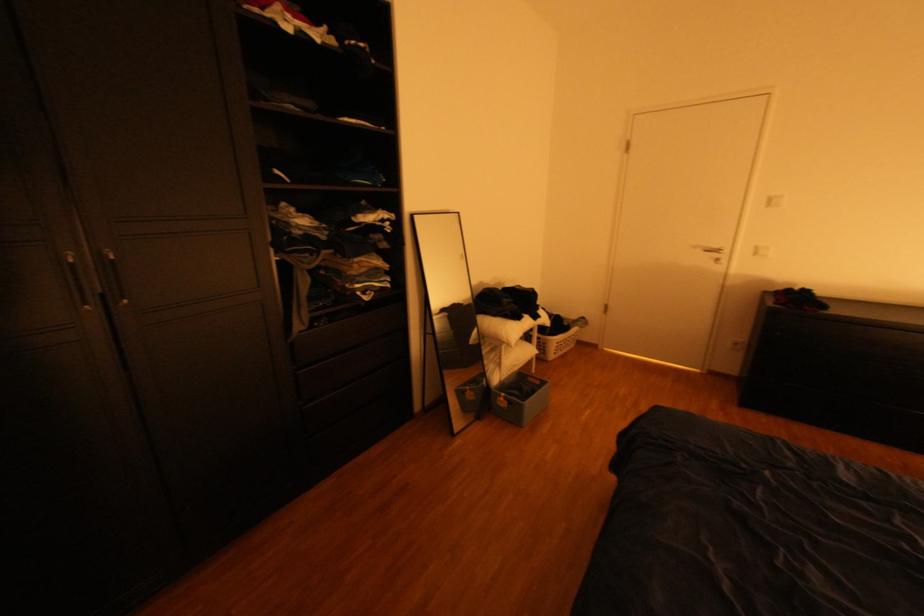
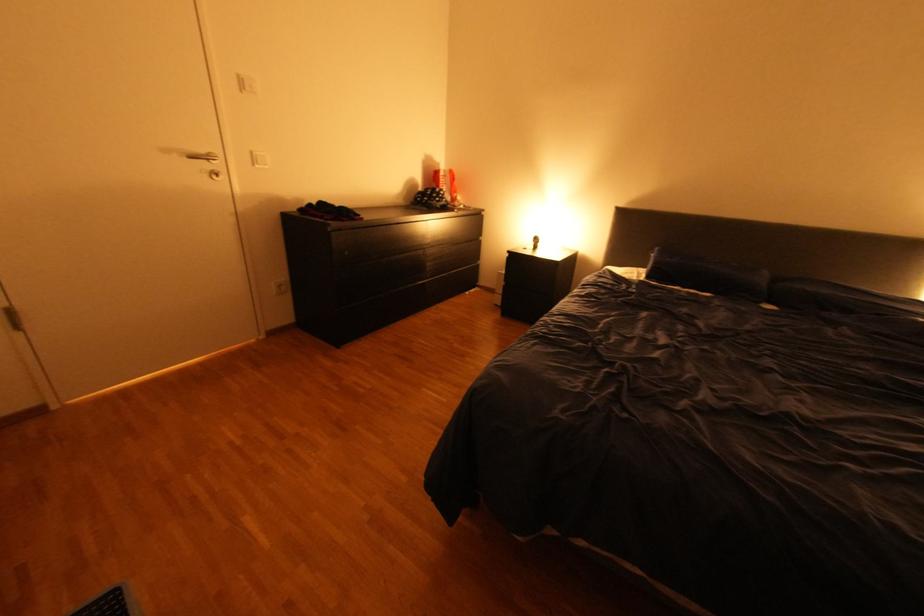
The point at (763, 254) is marked in the first image. Where is the corresponding point in the second image?

(264, 161)